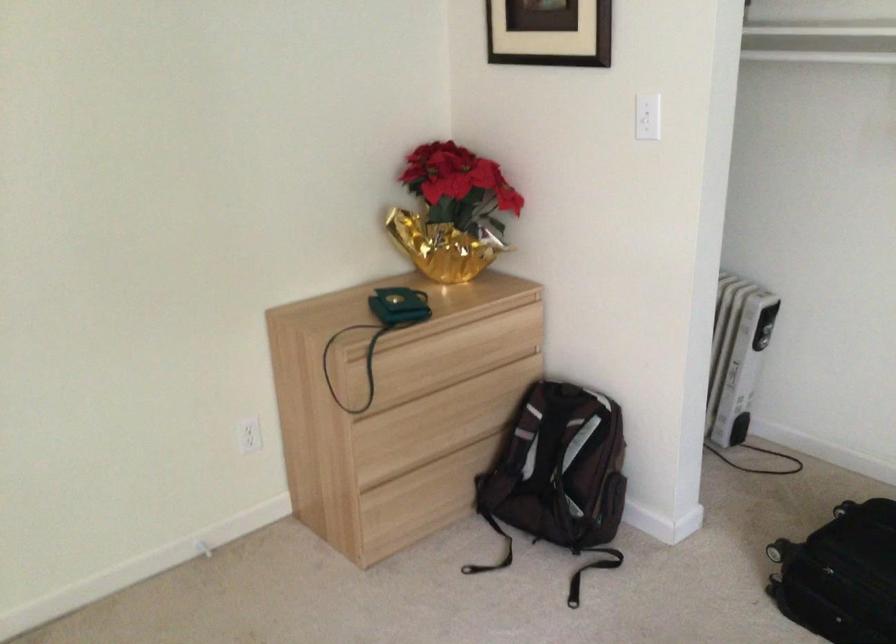
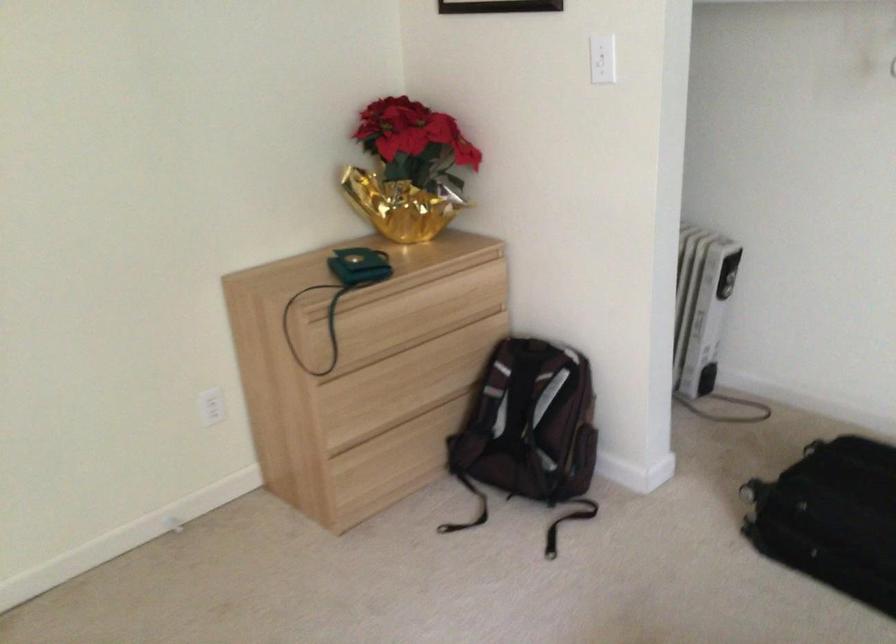
In the second image, find the point that corresponds to the point at 561,471 in the first image.

(531, 427)